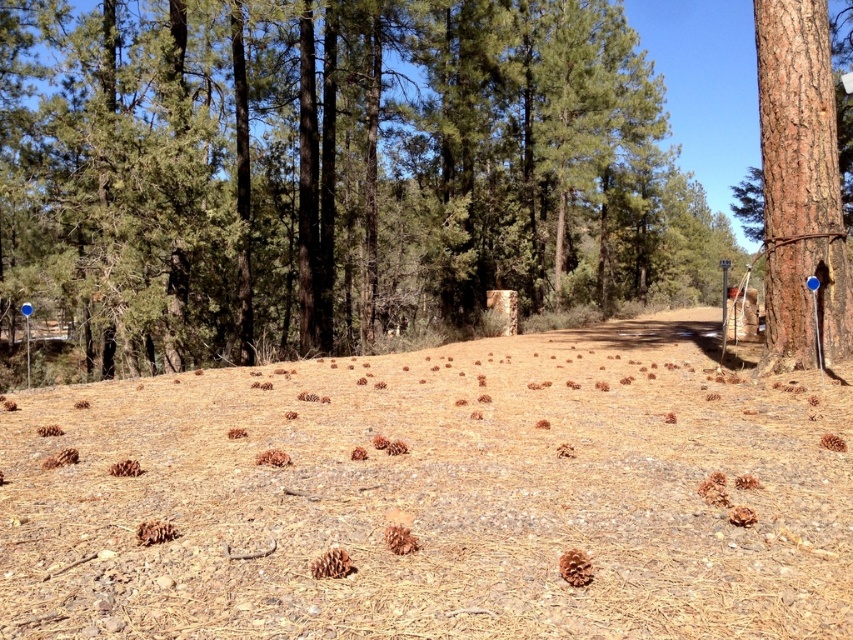
Question: Is green textured tree at center positioned in front of brown rough bark tree at right?

Choices:
 (A) yes
 (B) no

Answer: (B)

Question: Does green textured tree at center have a greater width compared to brown rough bark tree at right?

Choices:
 (A) yes
 (B) no

Answer: (A)

Question: Is green textured tree at center thinner than brown rough bark tree at right?

Choices:
 (A) no
 (B) yes

Answer: (A)

Question: Which object is farther from the camera taking this photo?

Choices:
 (A) brown rough bark tree at right
 (B) green textured tree at center

Answer: (B)

Question: Among these objects, which one is farthest from the camera?

Choices:
 (A) green textured tree at center
 (B) brown rough bark tree at right

Answer: (A)